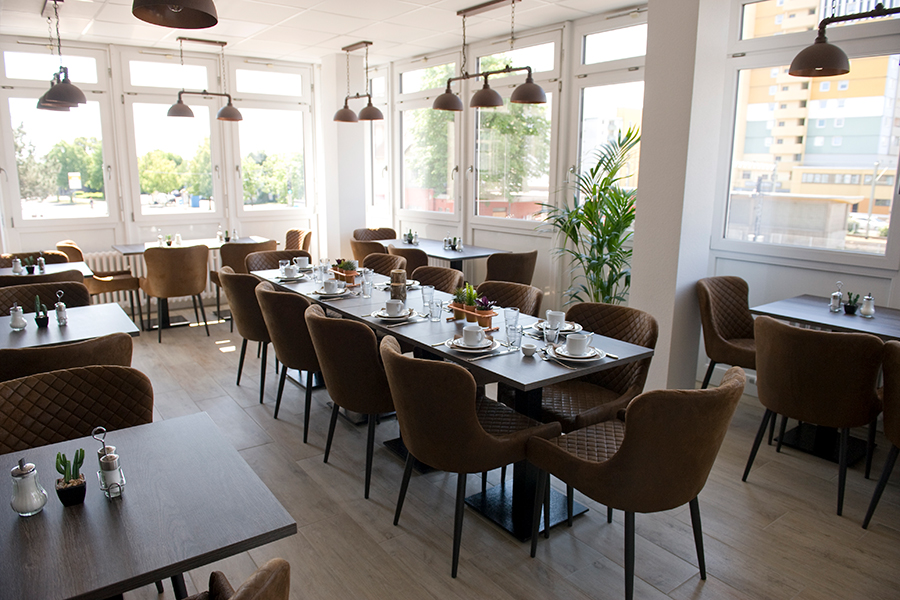
Identify the location of table bases. The image size is (900, 600). (819, 449), (499, 514), (391, 447), (347, 417), (299, 378), (171, 321), (220, 315), (117, 598), (457, 266).